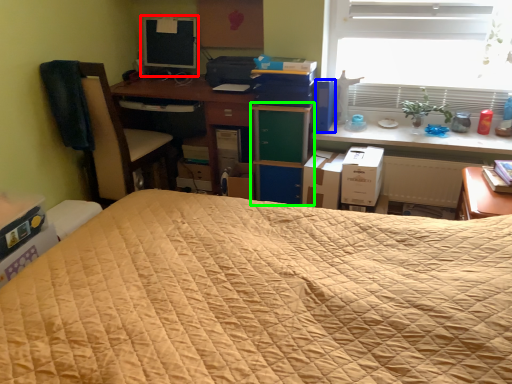
Question: Considering the real-world distances, which object is farthest from computer monitor (highlighted by a red box)? paperback book (highlighted by a blue box) or file cabinet (highlighted by a green box)?

Choices:
 (A) paperback book
 (B) file cabinet

Answer: (A)